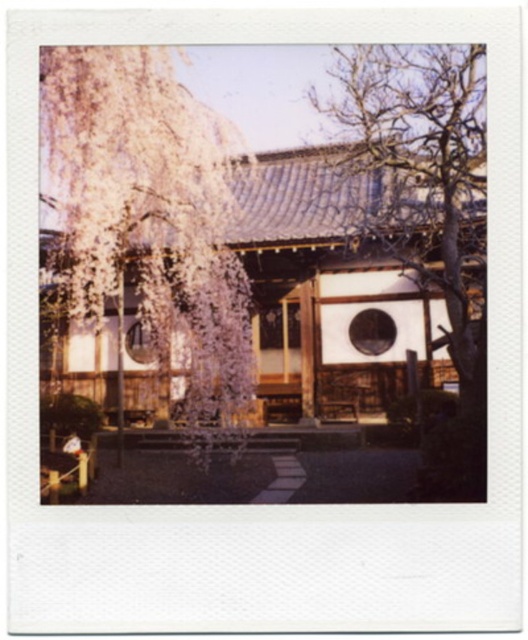
Question: Considering the relative positions of white silky tree at upper left and bare wood tree at right in the image provided, where is white silky tree at upper left located with respect to bare wood tree at right?

Choices:
 (A) left
 (B) right

Answer: (A)

Question: Which point is closer to the camera?

Choices:
 (A) (69, 145)
 (B) (474, 202)

Answer: (A)

Question: Can you confirm if white silky tree at upper left is bigger than bare wood tree at right?

Choices:
 (A) no
 (B) yes

Answer: (A)

Question: Which object appears farthest from the camera in this image?

Choices:
 (A) bare wood tree at right
 (B) white silky tree at upper left

Answer: (B)

Question: Among these objects, which one is farthest from the camera?

Choices:
 (A) bare wood tree at right
 (B) white silky tree at upper left

Answer: (B)

Question: From the image, what is the correct spatial relationship of white silky tree at upper left in relation to bare wood tree at right?

Choices:
 (A) left
 (B) right

Answer: (A)